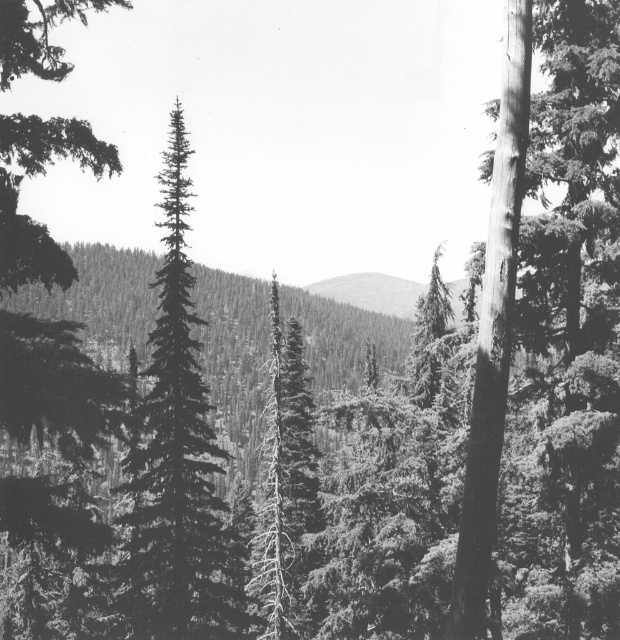
Question: Which is farther from the smooth bark tree at center?

Choices:
 (A) smooth dark green tree at left
 (B) dark green textured pine tree at center

Answer: (A)

Question: Is dark green textured pine tree at center further to camera compared to smooth gray mountain at center?

Choices:
 (A) no
 (B) yes

Answer: (A)

Question: Based on their relative distances, which object is farther from the dark green textured pine tree at center?

Choices:
 (A) smooth bark tree at center
 (B) smooth gray mountain at center

Answer: (B)

Question: Which object is the closest to the smooth bark tree at center?

Choices:
 (A) dark green textured pine tree at center
 (B) smooth dark green tree at left

Answer: (A)

Question: Can you confirm if dark green textured pine tree at center is bigger than smooth gray mountain at center?

Choices:
 (A) yes
 (B) no

Answer: (B)

Question: Does smooth bark tree at center have a lesser width compared to smooth gray mountain at center?

Choices:
 (A) yes
 (B) no

Answer: (A)